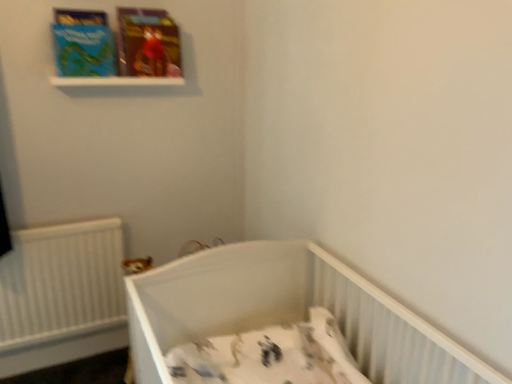
I want to click on vacant area on top of white plastic balustrade at upper center (from a real-world perspective), so click(x=115, y=70).